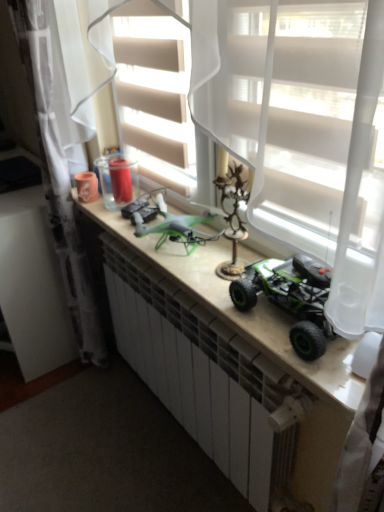
Question: Is white sheer curtain at upper left, which is the first curtain in left-to-right order, taller than white sheer curtain at center, positioned as the 1th curtain in right-to-left order?

Choices:
 (A) no
 (B) yes

Answer: (B)

Question: Does white sheer curtain at upper left, marked as the 2th curtain in a right-to-left arrangement, have a lesser width compared to white sheer curtain at center, positioned as the 1th curtain in right-to-left order?

Choices:
 (A) yes
 (B) no

Answer: (B)

Question: Is white sheer curtain at upper left, marked as the 2th curtain in a right-to-left arrangement, looking in the opposite direction of white sheer curtain at center, the second curtain from the left?

Choices:
 (A) no
 (B) yes

Answer: (A)

Question: From the image's perspective, is white sheer curtain at upper left, marked as the 2th curtain in a right-to-left arrangement, located beneath white sheer curtain at center, positioned as the 1th curtain in right-to-left order?

Choices:
 (A) no
 (B) yes

Answer: (B)

Question: Is white sheer curtain at center, the second curtain from the left, a part of white sheer curtain at upper left, marked as the 2th curtain in a right-to-left arrangement?

Choices:
 (A) no
 (B) yes

Answer: (A)

Question: Is white sheer curtain at upper left, marked as the 2th curtain in a right-to-left arrangement, bigger than white sheer curtain at center, the second curtain from the left?

Choices:
 (A) no
 (B) yes

Answer: (B)

Question: Could white sheer curtain at center, positioned as the 1th curtain in right-to-left order, be considered to be inside matte white counter at center?

Choices:
 (A) no
 (B) yes

Answer: (A)

Question: Is matte white counter at center to the right of white sheer curtain at center, positioned as the 1th curtain in right-to-left order, from the viewer's perspective?

Choices:
 (A) yes
 (B) no

Answer: (B)

Question: From the image's perspective, is matte white counter at center located above white sheer curtain at center, the second curtain from the left?

Choices:
 (A) no
 (B) yes

Answer: (A)

Question: Can you confirm if matte white counter at center is smaller than white sheer curtain at center, positioned as the 1th curtain in right-to-left order?

Choices:
 (A) no
 (B) yes

Answer: (A)

Question: Is matte white counter at center far away from white sheer curtain at center, positioned as the 1th curtain in right-to-left order?

Choices:
 (A) no
 (B) yes

Answer: (A)

Question: Is matte white counter at center to the left of white sheer curtain at center, positioned as the 1th curtain in right-to-left order, from the viewer's perspective?

Choices:
 (A) yes
 (B) no

Answer: (A)

Question: From a real-world perspective, is white sheer curtain at center, positioned as the 1th curtain in right-to-left order, beneath matte white counter at center?

Choices:
 (A) yes
 (B) no

Answer: (B)